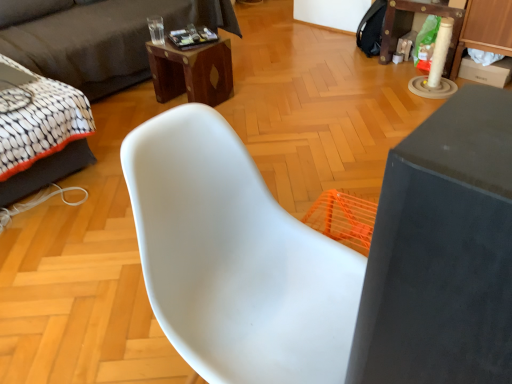
Question: Is wooden desk at upper center in front of or behind white plastic chair at center in the image?

Choices:
 (A) behind
 (B) front

Answer: (A)

Question: Is point (208, 99) positioned closer to the camera than point (219, 299)?

Choices:
 (A) closer
 (B) farther

Answer: (B)

Question: Based on their relative distances, which object is farther from the wooden table at upper right, the first table positioned from the right?

Choices:
 (A) white plastic chair at center
 (B) white fabric bed at left
 (C) matte gray table at right, the first table when ordered from bottom to top
 (D) wooden desk at upper center
 (E) dark gray fabric couch at upper left

Answer: (C)

Question: Based on their relative distances, which object is nearer to the wooden desk at upper center?

Choices:
 (A) white plastic chair at center
 (B) dark gray fabric couch at upper left
 (C) matte gray table at right, the 1th table in the front-to-back sequence
 (D) white fabric bed at left
 (E) wooden table at upper right, which is counted as the 1th table, starting from the back

Answer: (B)